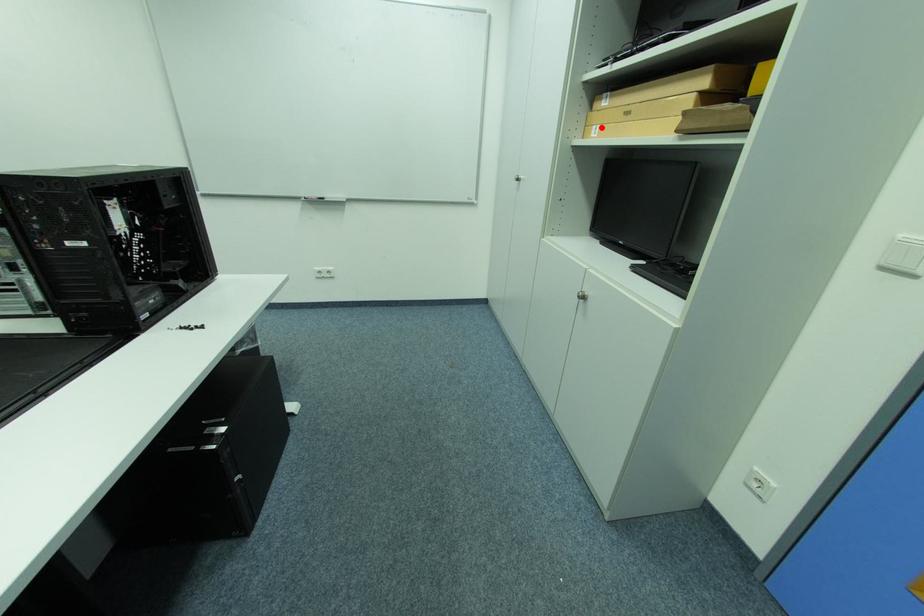
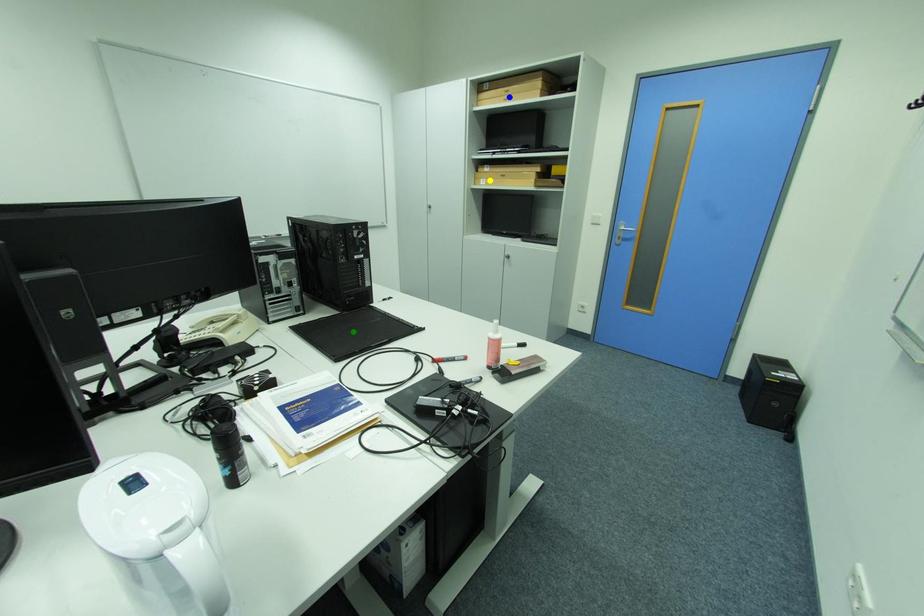
Question: I am providing you with two images of the same scene from different viewpoints. A red point is marked on the first image. You are given multiple points on the second image. Can you choose the point in image 2 that corresponds to the point in image 1?

Choices:
 (A) blue point
 (B) green point
 (C) yellow point

Answer: (C)